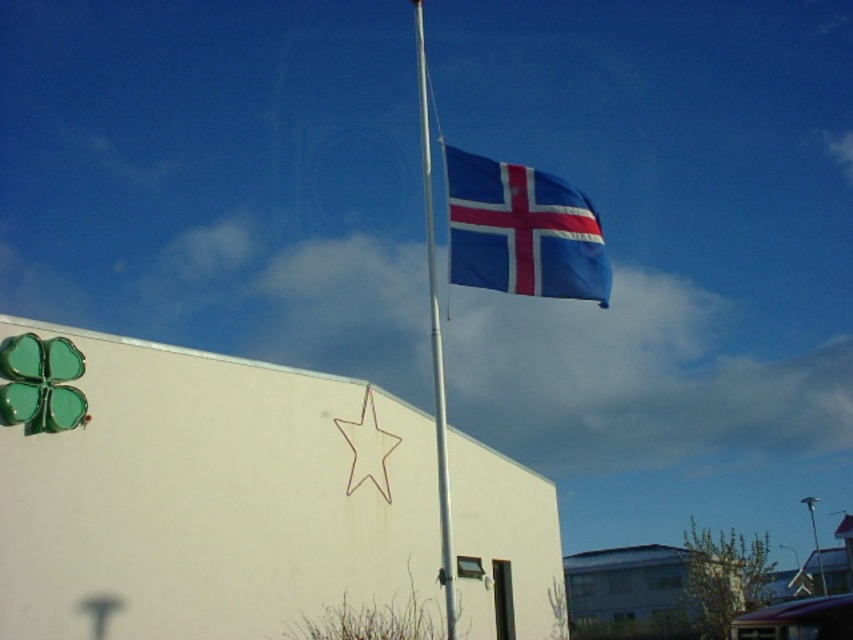
You are an architect designing a new building. You want to ensure that the flag displayed on the flagpole is visible from the street below. Given that the blue fabric flag at upper center is shorter than the silver metallic flag pole at center, which object would you need to adjust in height to make the flag more prominent?

To make the blue fabric flag at upper center more prominent, you should increase its height since it is currently shorter than the silver metallic flag pole at center.

You are standing in front of the building and looking at the blue fabric flag at upper center and the purple fabric at lower right. Which fabric is closer to you?

The blue fabric flag at upper center is closer to you because it is further to the viewer than the purple fabric at lower right.

You are a photographer trying to capture the silver metallic flag pole at center and the purple fabric at lower right in the same frame. Based on their positions, which object should you focus on first to ensure both are in the shot?

The silver metallic flag pole at center is above the purple fabric at lower right, so you should focus on the purple fabric at lower right first to ensure both are in the shot since it is lower and the flag pole is above it.